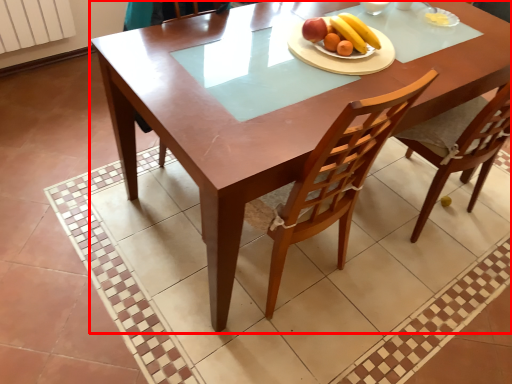
Question: Where is table (annotated by the red box) located in relation to fruit salad in the image?

Choices:
 (A) right
 (B) left

Answer: (B)